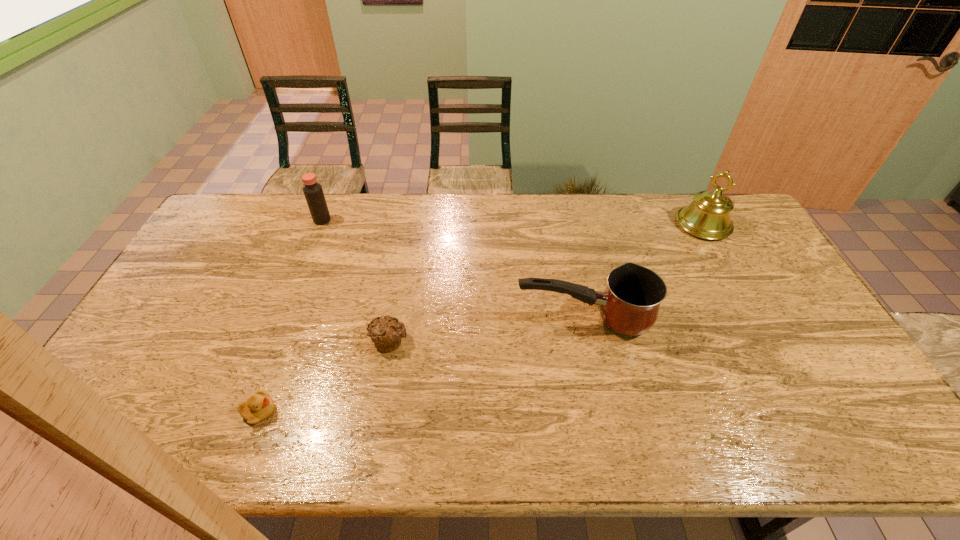
Locate an element on the screen. This screenshot has height=540, width=960. vacant space at the right edge is located at coordinates (768, 280).

Find the location of a particular element. vacant position at the far left corner of the desktop is located at coordinates [254, 222].

The width and height of the screenshot is (960, 540). What are the coordinates of `free space at the near right corner` in the screenshot? It's located at (887, 433).

In order to click on empty space between the rightmost object and the duckling in this screenshot , I will do point(481,318).

The width and height of the screenshot is (960, 540). I want to click on vacant area that lies between the duckling and the vinegar, so click(291, 316).

Where is `empty location between the vinegar and the tallest object`? empty location between the vinegar and the tallest object is located at coordinates click(513, 222).

Identify the location of vacant space that is in between the bell and the vinegar. (513, 222).

Identify the location of empty location between the vinegar and the rightmost object. Image resolution: width=960 pixels, height=540 pixels. (513, 222).

Find the location of `free spot between the nearest object and the saucepan`. free spot between the nearest object and the saucepan is located at coordinates (421, 365).

Where is `free space between the rightmost object and the duckling`? free space between the rightmost object and the duckling is located at coordinates (481, 318).